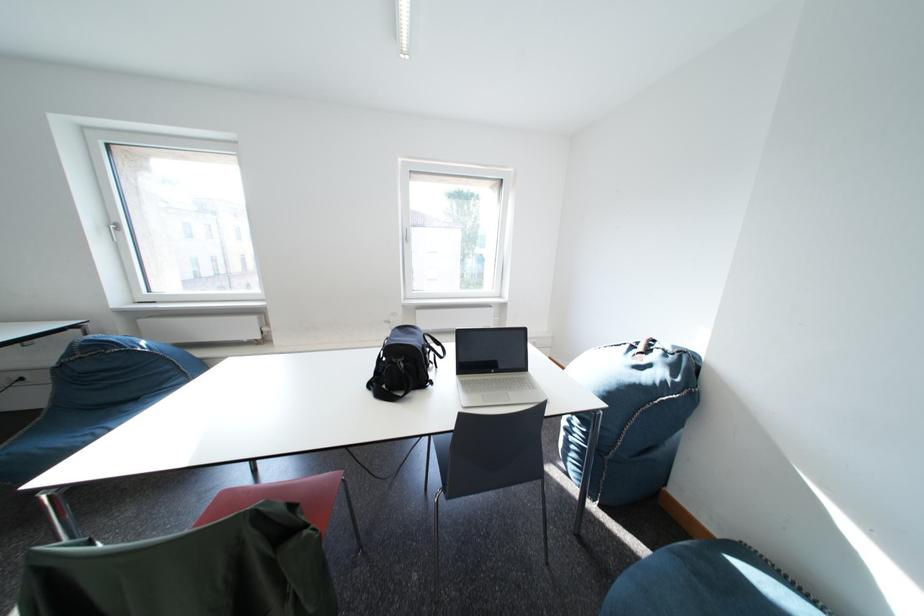
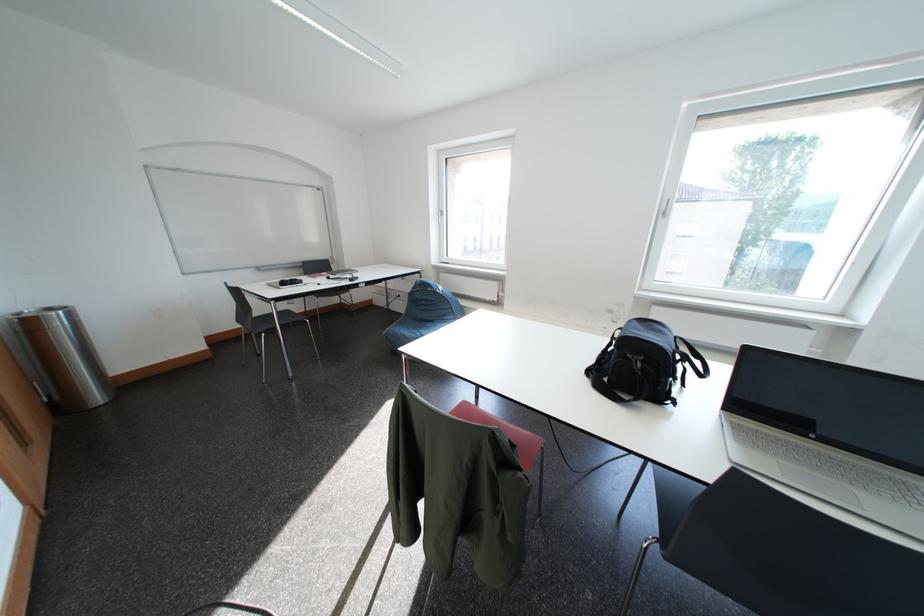
Question: Based on the continuous images, in which direction is the camera rotating? Reply with the corresponding letter.

Choices:
 (A) Left
 (B) Right
 (C) Up
 (D) Down

Answer: (A)